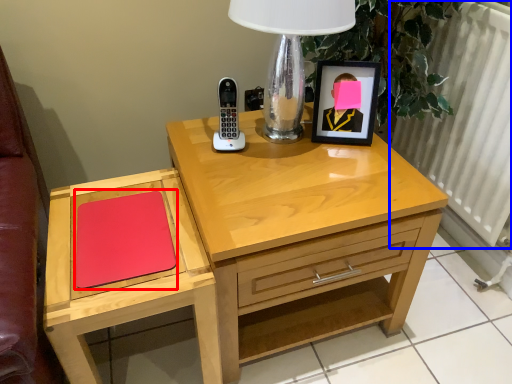
Question: Among these objects, which one is farthest to the camera, notepad (highlighted by a red box) or radiator (highlighted by a blue box)?

Choices:
 (A) notepad
 (B) radiator

Answer: (B)